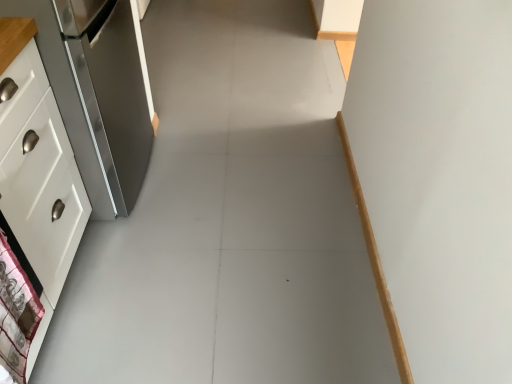
Question: Is white glossy cabinet at left to the right of satin silver refrigerator at left from the viewer's perspective?

Choices:
 (A) yes
 (B) no

Answer: (B)

Question: Does white glossy cabinet at left contain satin silver refrigerator at left?

Choices:
 (A) yes
 (B) no

Answer: (B)

Question: Are white glossy cabinet at left and satin silver refrigerator at left making contact?

Choices:
 (A) yes
 (B) no

Answer: (B)

Question: From the image's perspective, is white glossy cabinet at left located beneath satin silver refrigerator at left?

Choices:
 (A) no
 (B) yes

Answer: (B)

Question: Is white glossy cabinet at left completely or partially outside of satin silver refrigerator at left?

Choices:
 (A) no
 (B) yes

Answer: (B)

Question: From a real-world perspective, is white fabric with pattern at lower left above or below white glossy cabinet at left?

Choices:
 (A) below
 (B) above

Answer: (B)

Question: From the image's perspective, is white fabric with pattern at lower left located above or below white glossy cabinet at left?

Choices:
 (A) above
 (B) below

Answer: (B)

Question: In terms of size, does white fabric with pattern at lower left appear bigger or smaller than white glossy cabinet at left?

Choices:
 (A) big
 (B) small

Answer: (B)

Question: Does point (26, 329) appear closer or farther from the camera than point (44, 152)?

Choices:
 (A) farther
 (B) closer

Answer: (B)

Question: Is satin silver refrigerator at left taller or shorter than white glossy cabinet at left?

Choices:
 (A) short
 (B) tall

Answer: (B)

Question: Is satin silver refrigerator at left in front of or behind white glossy cabinet at left in the image?

Choices:
 (A) behind
 (B) front

Answer: (A)

Question: From a real-world perspective, is satin silver refrigerator at left physically located above or below white glossy cabinet at left?

Choices:
 (A) below
 (B) above

Answer: (B)

Question: Considering the positions of point (66, 102) and point (46, 99), is point (66, 102) closer or farther from the camera than point (46, 99)?

Choices:
 (A) closer
 (B) farther

Answer: (B)

Question: Visually, is white glossy cabinet at left positioned to the left or to the right of satin silver refrigerator at left?

Choices:
 (A) right
 (B) left

Answer: (B)

Question: Is white glossy cabinet at left spatially inside satin silver refrigerator at left, or outside of it?

Choices:
 (A) outside
 (B) inside

Answer: (A)